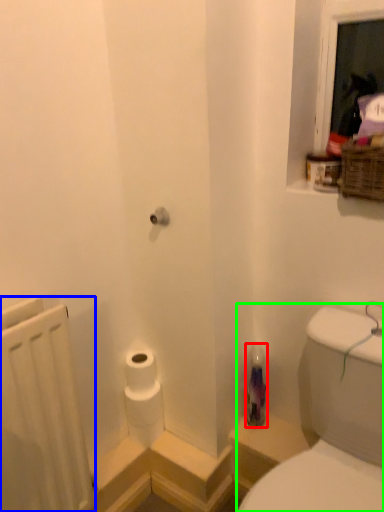
Question: Considering the real-world distances, which object is farthest from bottle (highlighted by a red box)? radiator (highlighted by a blue box) or sink (highlighted by a green box)?

Choices:
 (A) radiator
 (B) sink

Answer: (A)